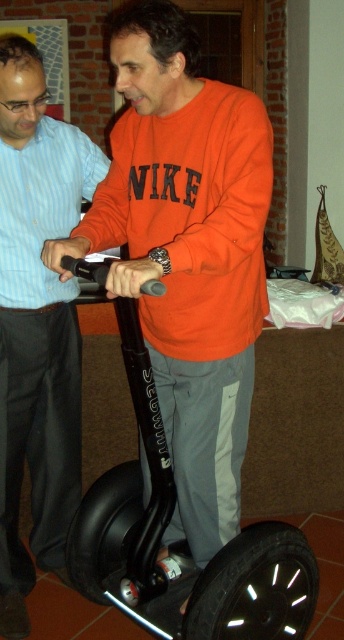
Where is `matte black scooter at center`? This screenshot has width=344, height=640. matte black scooter at center is located at coordinates (37, 324).

Measure the distance between point (19,208) and camera.

They are 1.90 meters apart.

The image size is (344, 640). In order to click on matte black scooter at center in this screenshot , I will do click(x=37, y=324).

Does point (149, 230) lie behind point (39, 150)?

No, it is not.

Between point (155, 84) and point (29, 381), which one is positioned behind?

Positioned behind is point (29, 381).

Does point (202, 467) come closer to viewer compared to point (9, 474)?

That is True.

Identify the location of orange matte sweatshirt at center. (187, 253).

Looking at this image, which of these two, orange matte sweatshirt at center or black rubber scooter at center, stands shorter?

black rubber scooter at center

Between orange matte sweatshirt at center and black rubber scooter at center, which one appears on the right side from the viewer's perspective?

From the viewer's perspective, orange matte sweatshirt at center appears more on the right side.

The height and width of the screenshot is (640, 344). I want to click on orange matte sweatshirt at center, so click(x=187, y=253).